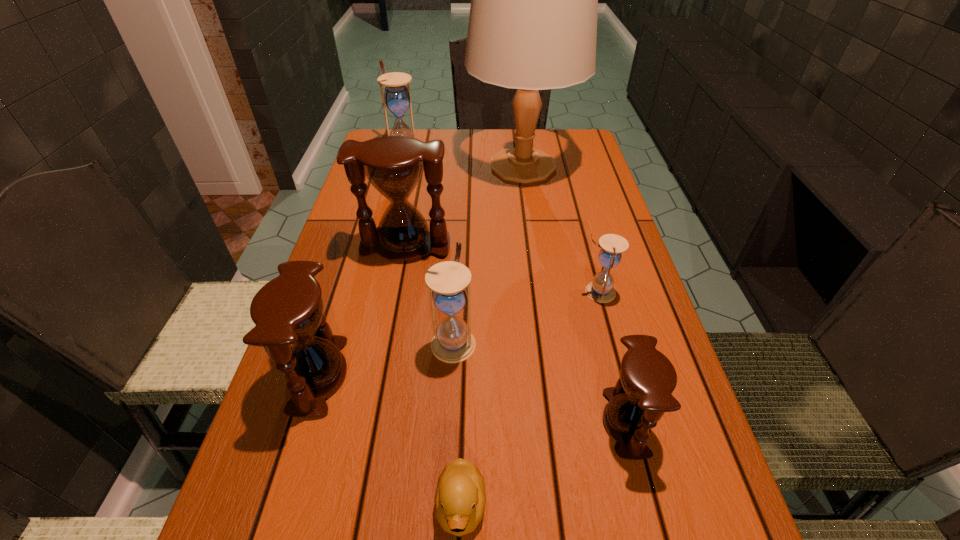
Where is `hourglass situated at the far edge`? hourglass situated at the far edge is located at coordinates (396, 97).

Where is `table lamp located in the right edge section of the desktop`? The height and width of the screenshot is (540, 960). table lamp located in the right edge section of the desktop is located at coordinates (534, 0).

Identify the location of object that is at the far left corner. (396, 97).

Locate an element on the screen. Image resolution: width=960 pixels, height=540 pixels. object present at the far right corner is located at coordinates (534, 0).

Where is `vacant area at the left edge of the desktop`? The image size is (960, 540). vacant area at the left edge of the desktop is located at coordinates (359, 240).

In the image, there is a desktop. Where is `vacant space at the right edge`? This screenshot has width=960, height=540. vacant space at the right edge is located at coordinates (706, 459).

The image size is (960, 540). Find the location of `free space at the far right corner`. free space at the far right corner is located at coordinates (576, 148).

At what (x,y) coordinates should I click in order to perform the action: click on vacant area that lies between the second biggest brown hourglass and the rightmost brown hourglass. Please return your answer as a coordinate pair (x, y). Looking at the image, I should click on (472, 400).

The height and width of the screenshot is (540, 960). In order to click on unoccupied position between the smallest brown hourglass and the second smallest brown hourglass in this screenshot , I will do `click(472, 400)`.

Where is `vacant region between the second smallest brown hourglass and the second smallest white hourglass`? vacant region between the second smallest brown hourglass and the second smallest white hourglass is located at coordinates (386, 359).